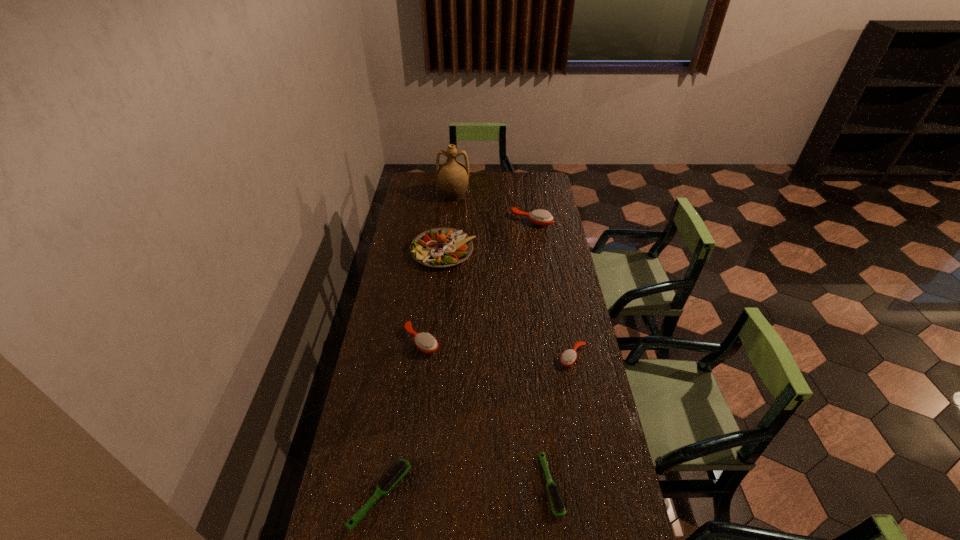
Locate an element on the screen. salad plate present at the left edge is located at coordinates (441, 247).

The image size is (960, 540). In the image, there is a desktop. What are the coordinates of `vacant space at the far edge` in the screenshot? It's located at (509, 190).

The image size is (960, 540). I want to click on vacant space at the left edge of the desktop, so click(x=360, y=409).

In the image, there is a desktop. Identify the location of vacant space at the right edge. (541, 244).

Image resolution: width=960 pixels, height=540 pixels. What are the coordinates of `vacant space at the far left corner of the desktop` in the screenshot? It's located at (434, 177).

This screenshot has height=540, width=960. Identify the location of vacant region at the far right corner of the desktop. 553,191.

Identify the location of free space between the right light hairbrush and the fifth nearest object. (497, 368).

Where is `blank region between the fourth shortest hairbrush and the biggest orange hairbrush`? This screenshot has width=960, height=540. blank region between the fourth shortest hairbrush and the biggest orange hairbrush is located at coordinates (477, 281).

Find the location of a particular element. The height and width of the screenshot is (540, 960). vacant space in between the tallest hairbrush and the smallest orange hairbrush is located at coordinates (552, 289).

This screenshot has width=960, height=540. In order to click on free space between the bigger light hairbrush and the shortest object in this screenshot , I will do `click(466, 490)`.